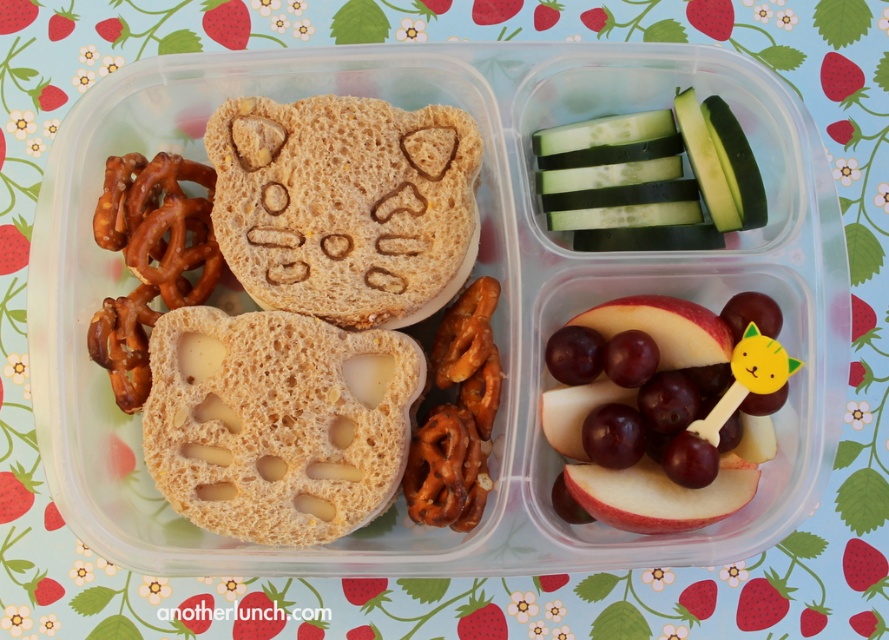
You are packing a lunchbox and want to place both the peanut butter sandwich at left and the brown porous bread at center into a rectangular container. Which one should you place first to ensure both fit properly?

You should place the peanut butter sandwich at left first because it is wider than the brown porous bread at center, allowing enough space for both to fit in the container.

What are the coordinates of the peanut butter sandwich at left in the bento box?

The peanut butter sandwich at left is located at coordinates point (310, 314).

You are a child who wants to eat the peanut butter sandwich at left and the brown porous bread at center. Which one can you reach first if you are sitting in front of the bento box?

The peanut butter sandwich at left can be reached first because it is in front of the brown porous bread at center, making it closer to you.